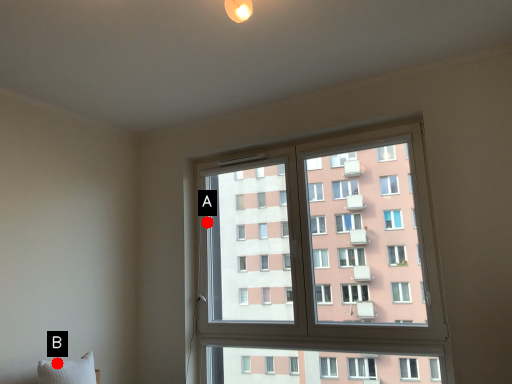
Question: Two points are circled on the image, labeled by A and B beside each circle. Which of the following is the closest to the observer?

Choices:
 (A) A is closer
 (B) B is closer

Answer: (B)